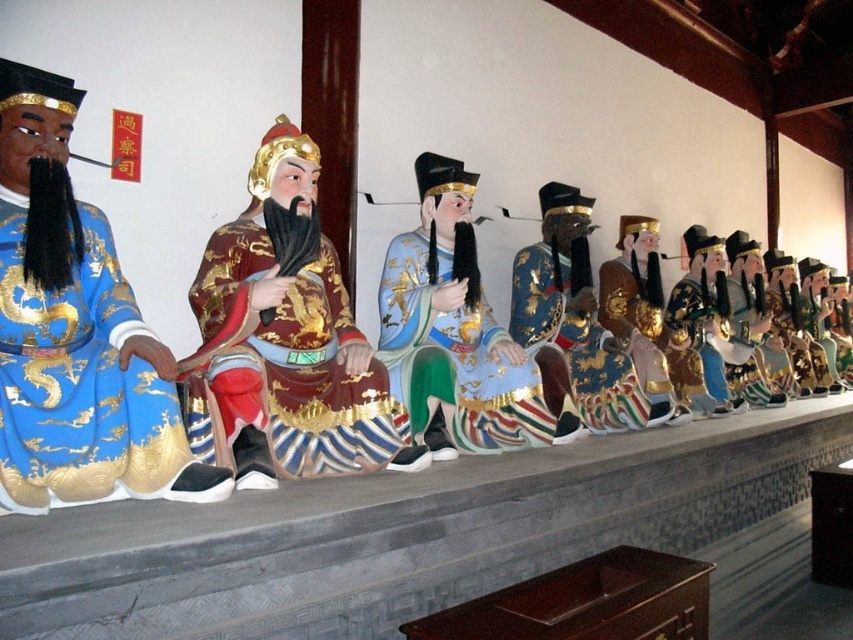
Which is above, blue silk robe at left or shiny blue silk robe at center?

shiny blue silk robe at center is higher up.

Is blue silk robe at left to the left of shiny blue silk robe at center from the viewer's perspective?

Indeed, blue silk robe at left is positioned on the left side of shiny blue silk robe at center.

Measure the distance between blue silk robe at left and camera.

blue silk robe at left is 7.15 feet away from camera.

At what (x,y) coordinates should I click in order to perform the action: click on blue silk robe at left. Please return your answer as a coordinate pair (x, y). Looking at the image, I should click on click(78, 381).

Identify the location of shiny blue fabric robe at center. The width and height of the screenshot is (853, 640). (573, 333).

Between point (579, 252) and point (608, 304), which one is positioned behind?

Point (608, 304)

Where is `shiny blue fabric robe at center`? The width and height of the screenshot is (853, 640). shiny blue fabric robe at center is located at coordinates (573, 333).

Is shiny blue silk robe at center taller than shiny blue fabric robe at center?

Incorrect, shiny blue silk robe at center's height is not larger of shiny blue fabric robe at center's.

Consider the image. Can you confirm if shiny blue silk robe at center is wider than shiny blue fabric robe at center?

Indeed, shiny blue silk robe at center has a greater width compared to shiny blue fabric robe at center.

Between point (434, 291) and point (576, 360), which one is positioned behind?

Point (576, 360)

Where is `shiny blue silk robe at center`? shiny blue silk robe at center is located at coordinates (454, 355).